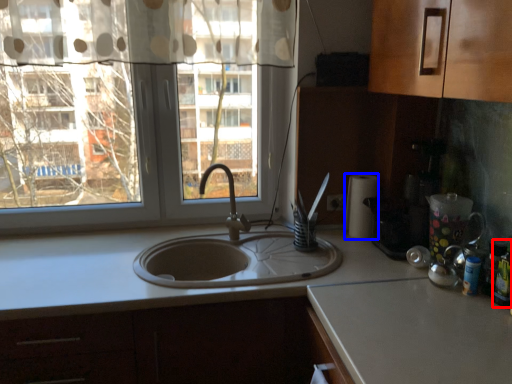
Question: Which object is closer to the camera taking this photo, bottle (highlighted by a red box) or paper towel (highlighted by a blue box)?

Choices:
 (A) bottle
 (B) paper towel

Answer: (A)